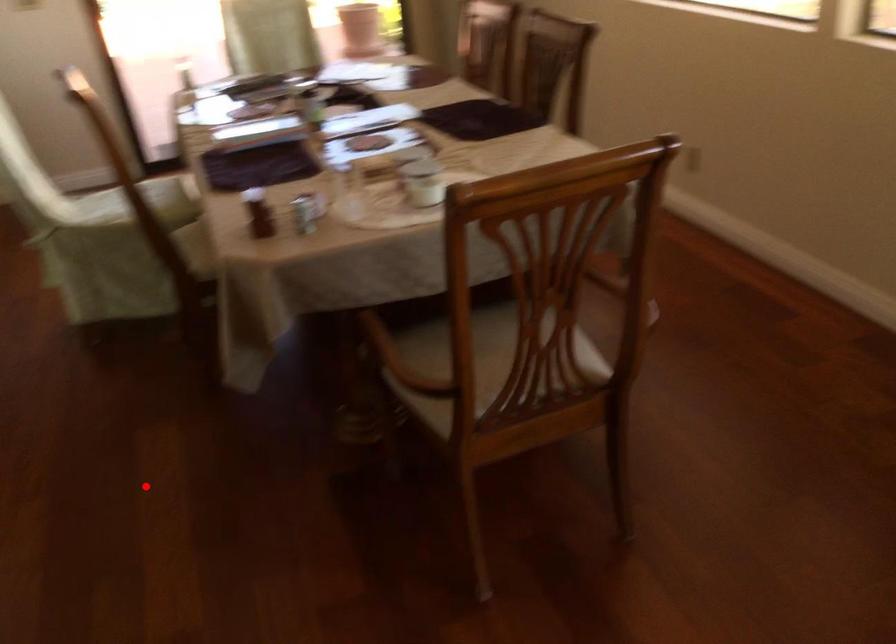
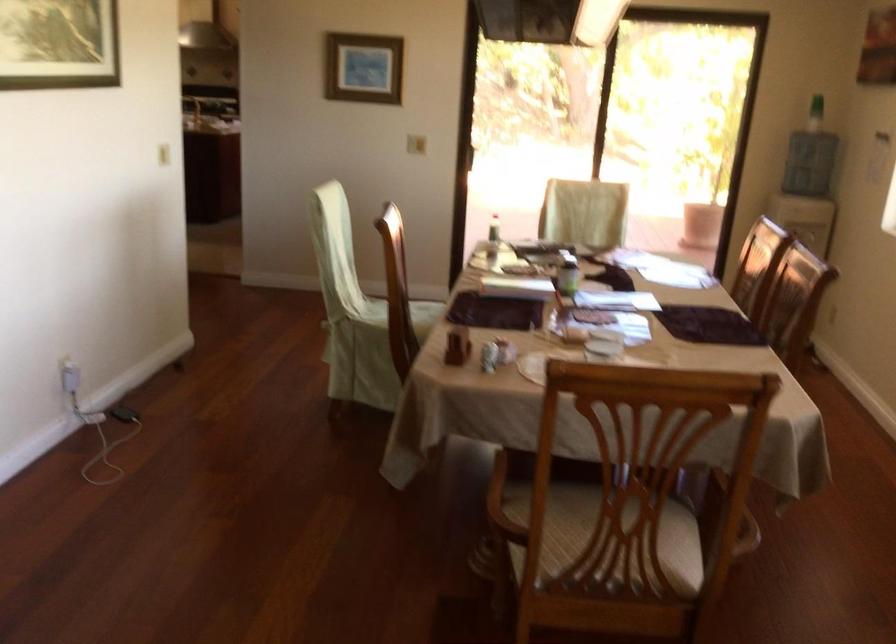
Question: I am providing you with two images of the same scene from different viewpoints. A red point is shown in image1. For the corresponding object point in image2, is it positioned nearer or farther from the camera?

Choices:
 (A) Nearer
 (B) Farther

Answer: (B)